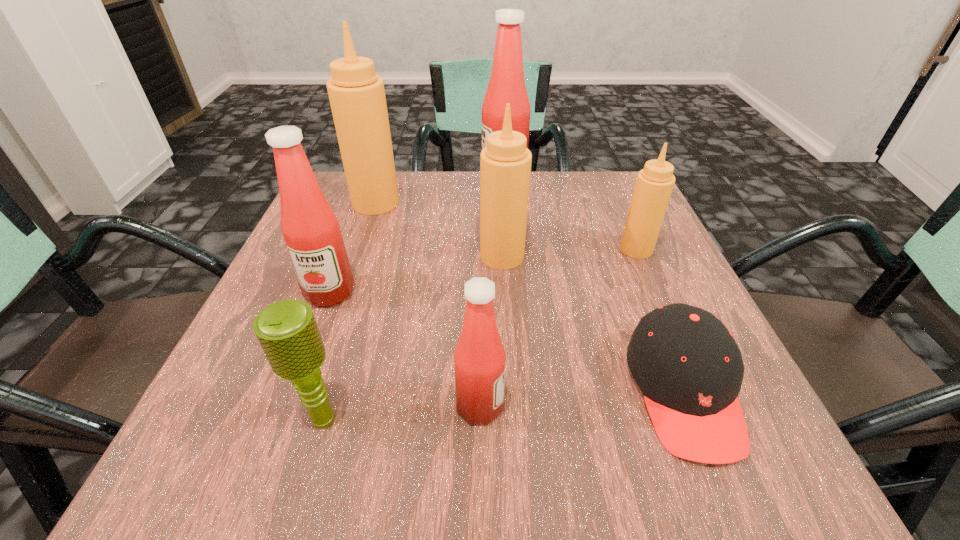
Identify the location of vacant space in between the second smallest red condiment and the nearest red condiment. The height and width of the screenshot is (540, 960). (405, 349).

Where is `free space between the cap and the second nearest red condiment`? free space between the cap and the second nearest red condiment is located at coordinates (507, 342).

Locate an element on the screen. This screenshot has height=540, width=960. free point between the nearest condiment and the leftmost tan condiment is located at coordinates (428, 305).

This screenshot has width=960, height=540. What are the coordinates of `empty space that is in between the smallest tan condiment and the second biggest tan condiment` in the screenshot? It's located at (569, 253).

Find the location of a particular element. The image size is (960, 540). empty space between the biggest red condiment and the cap is located at coordinates (593, 288).

Identify which object is the second closest to the cap. Please provide its 2D coordinates. Your answer should be formatted as a tuple, i.e. [(x, y)], where the tuple contains the x and y coordinates of a point satisfying the conditions above.

[(654, 184)]

Where is `object that is the closest to the nearest red condiment`? The width and height of the screenshot is (960, 540). object that is the closest to the nearest red condiment is located at coordinates (287, 331).

I want to click on condiment that is the third closest to the biggest red condiment, so click(654, 184).

Identify which condiment is the fifth closest to the rightmost tan condiment. Please provide its 2D coordinates. Your answer should be formatted as a tuple, i.e. [(x, y)], where the tuple contains the x and y coordinates of a point satisfying the conditions above.

[(311, 231)]

Select which red condiment is the second closest to the shortest object. Please provide its 2D coordinates. Your answer should be formatted as a tuple, i.e. [(x, y)], where the tuple contains the x and y coordinates of a point satisfying the conditions above.

[(311, 231)]